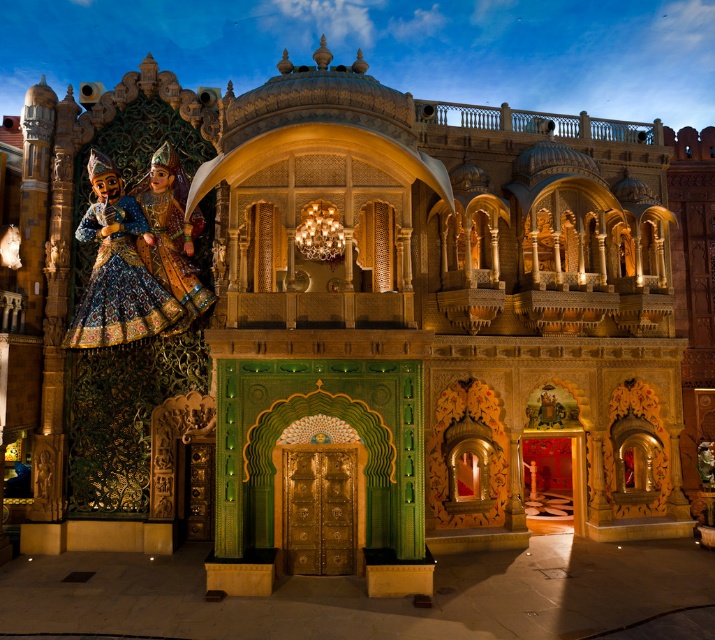
Question: Can you confirm if blue embroidered fabric at left is positioned to the left of shiny gold dress at left?

Choices:
 (A) yes
 (B) no

Answer: (A)

Question: Which point is closer to the camera?

Choices:
 (A) blue embroidered fabric at left
 (B) shiny gold dress at left

Answer: (B)

Question: Can you confirm if blue embroidered fabric at left is positioned above shiny gold dress at left?

Choices:
 (A) no
 (B) yes

Answer: (A)

Question: Does blue embroidered fabric at left have a greater width compared to shiny gold dress at left?

Choices:
 (A) yes
 (B) no

Answer: (B)